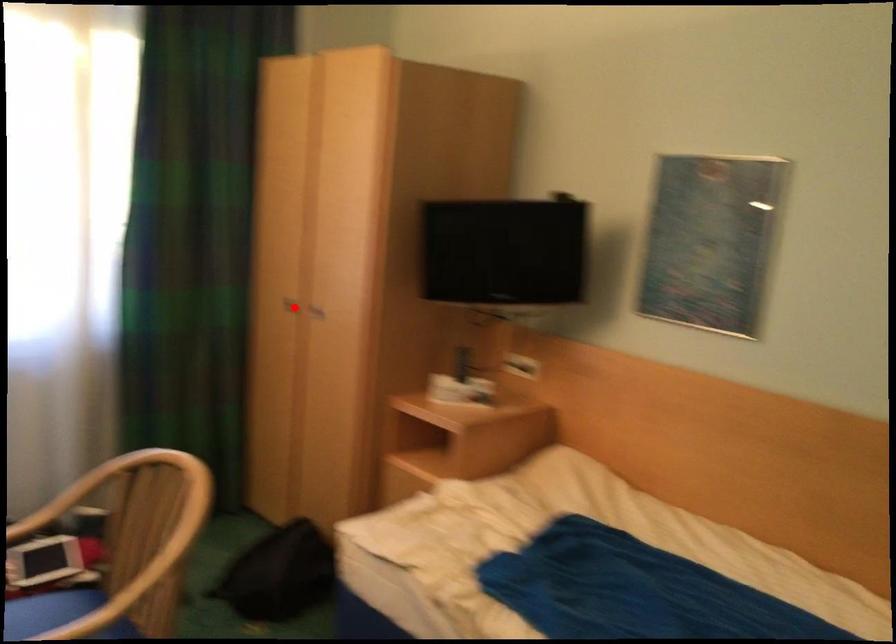
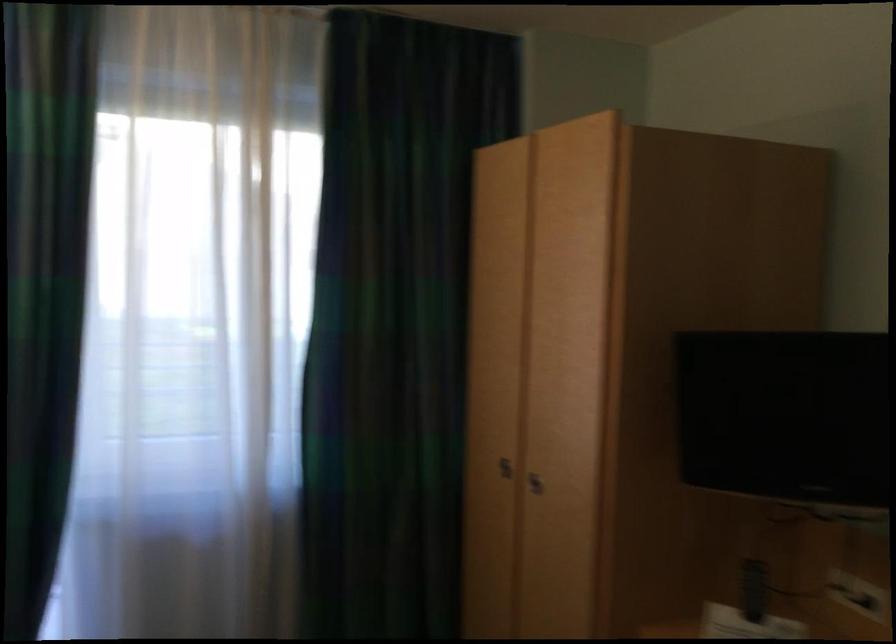
Question: I am providing you with two images of the same scene from different viewpoints. A red point is marked on the first image. Can you still see the location of the red point in image 2?

Choices:
 (A) Yes
 (B) No

Answer: (A)